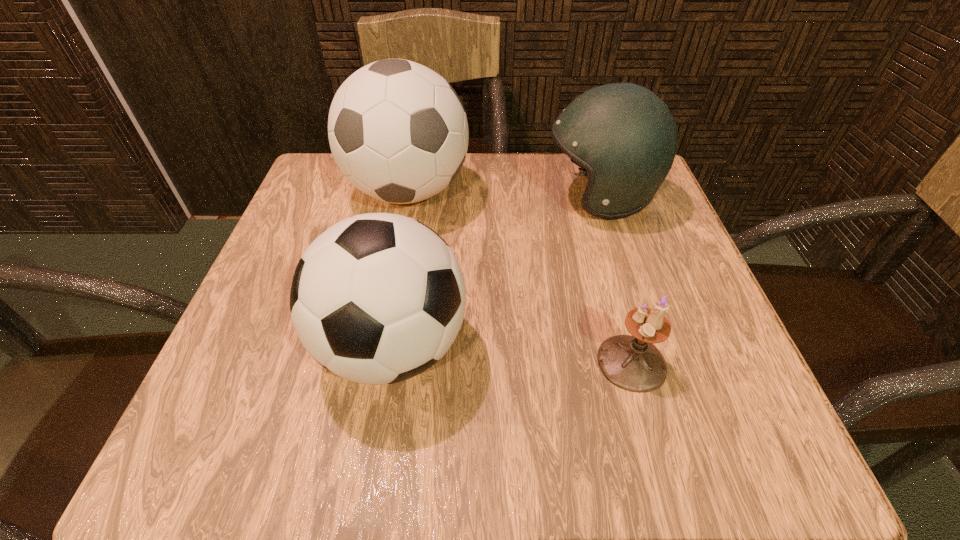
Identify the location of free location at the left edge of the desktop. The width and height of the screenshot is (960, 540). (236, 341).

The image size is (960, 540). In the image, there is a desktop. Find the location of `vacant space at the right edge`. vacant space at the right edge is located at coordinates (679, 350).

This screenshot has width=960, height=540. I want to click on free spot at the far left corner of the desktop, so click(x=330, y=179).

In the image, there is a desktop. At what (x,y) coordinates should I click in order to perform the action: click on free region at the near left corner. Please return your answer as a coordinate pair (x, y). Looking at the image, I should click on (290, 421).

Identify the location of free space between the football helmet and the nearer soccer ball. coord(496,272).

Find the location of a particular element. The image size is (960, 540). free space between the candle holder and the nearer soccer ball is located at coordinates (513, 355).

Identify the location of vacant space that's between the candle holder and the shorter soccer ball. (513, 355).

Locate an element on the screen. This screenshot has width=960, height=540. vacant area between the shorter soccer ball and the shortest object is located at coordinates [x=513, y=355].

Locate an element on the screen. The image size is (960, 540). vacant area that lies between the taller soccer ball and the candle holder is located at coordinates (519, 277).

Locate an element on the screen. The width and height of the screenshot is (960, 540). empty location between the football helmet and the shortest object is located at coordinates (616, 279).